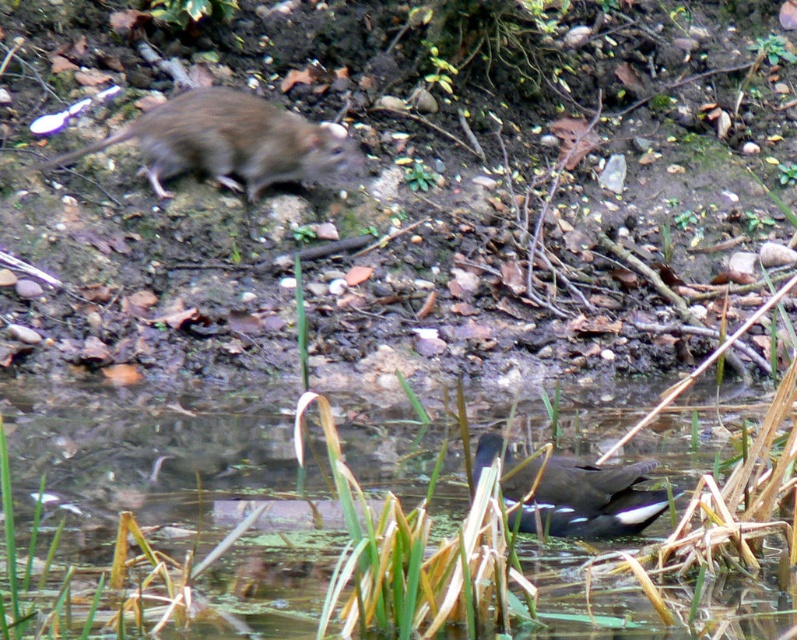
Question: Does translucent water at center have a greater width compared to fur-like gray rat at upper left?

Choices:
 (A) yes
 (B) no

Answer: (A)

Question: Which object appears farthest from the camera in this image?

Choices:
 (A) translucent water at center
 (B) dark brown feathers at lower center
 (C) fur-like gray rat at upper left

Answer: (C)

Question: Does translucent water at center have a lesser width compared to fur-like gray rat at upper left?

Choices:
 (A) no
 (B) yes

Answer: (A)

Question: Does fur-like gray rat at upper left lie behind dark brown feathers at lower center?

Choices:
 (A) no
 (B) yes

Answer: (B)

Question: Which point is closer to the camera?

Choices:
 (A) dark brown feathers at lower center
 (B) translucent water at center
 (C) fur-like gray rat at upper left

Answer: (A)

Question: Considering the real-world distances, which object is farthest from the translucent water at center?

Choices:
 (A) fur-like gray rat at upper left
 (B) dark brown feathers at lower center

Answer: (A)